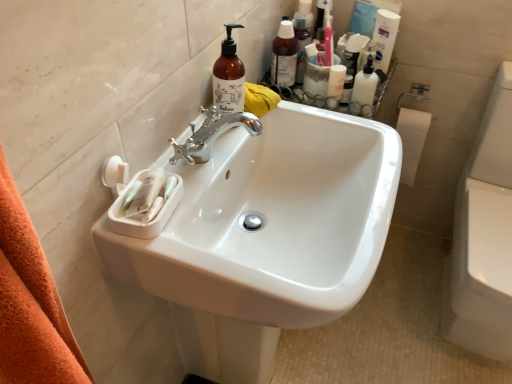
What is the approximate width of white glossy lotion at upper right, marked as the 3th toiletry in a left-to-right arrangement?

white glossy lotion at upper right, marked as the 3th toiletry in a left-to-right arrangement, is 1.95 inches wide.

What is the approximate height of white glossy lotion at upper right, acting as the first toiletry starting from the right?

white glossy lotion at upper right, acting as the first toiletry starting from the right, is 5.94 inches in height.

Describe the element at coordinates (384, 38) in the screenshot. I see `white glossy lotion at upper right, the first cleaning product viewed from the right` at that location.

Image resolution: width=512 pixels, height=384 pixels. What do you see at coordinates (271, 221) in the screenshot?
I see `white glossy sink at center` at bounding box center [271, 221].

The width and height of the screenshot is (512, 384). What do you see at coordinates (336, 81) in the screenshot?
I see `white matte jar at upper right, the second toiletry viewed from the left` at bounding box center [336, 81].

Find the location of a particular element. The width and height of the screenshot is (512, 384). translucent plastic bottles at upper right, which is the 1th toiletry in left-to-right order is located at coordinates (284, 56).

Where is `white glossy lotion at upper right, acting as the first toiletry starting from the right`? The image size is (512, 384). white glossy lotion at upper right, acting as the first toiletry starting from the right is located at coordinates (364, 89).

Which object is closer to the camera, white glossy toilet bowl at right or white matte jar at upper right, the 2th toiletry when ordered from right to left?

white glossy toilet bowl at right.

Who is bigger, white glossy toilet bowl at right or white matte jar at upper right, the 2th toiletry when ordered from right to left?

white glossy toilet bowl at right is bigger.

Looking at this image, from the image's perspective, which is below, white glossy toilet bowl at right or white matte jar at upper right, the second toiletry viewed from the left?

white glossy toilet bowl at right, from the image's perspective.

From a real-world perspective, is white glossy toilet bowl at right above or below white matte jar at upper right, the second toiletry viewed from the left?

white glossy toilet bowl at right is situated lower than white matte jar at upper right, the second toiletry viewed from the left, in the real world.

From the image's perspective, which is below, white glossy lotion at upper right, marked as the 3th toiletry in a left-to-right arrangement, or white glossy toilet bowl at right?

white glossy toilet bowl at right.

Between white glossy lotion at upper right, acting as the first toiletry starting from the right, and white glossy toilet bowl at right, which one has less height?

white glossy lotion at upper right, acting as the first toiletry starting from the right.

Is white glossy lotion at upper right, marked as the 3th toiletry in a left-to-right arrangement, thinner than white glossy toilet bowl at right?

Indeed, white glossy lotion at upper right, marked as the 3th toiletry in a left-to-right arrangement, has a lesser width compared to white glossy toilet bowl at right.

Which is in front, point (356, 100) or point (509, 269)?

The point (509, 269) is in front.

Can you confirm if white glossy sink at center is bigger than white glossy lotion at upper right, marked as the 3th toiletry in a left-to-right arrangement?

Indeed, white glossy sink at center has a larger size compared to white glossy lotion at upper right, marked as the 3th toiletry in a left-to-right arrangement.

What's the angular difference between white glossy sink at center and white glossy lotion at upper right, acting as the first toiletry starting from the right,'s facing directions?

91.2 degrees.

Can we say white glossy sink at center lies outside white glossy lotion at upper right, marked as the 3th toiletry in a left-to-right arrangement?

Yes, white glossy sink at center is outside of white glossy lotion at upper right, marked as the 3th toiletry in a left-to-right arrangement.

Looking at this image, which of these two, white glossy sink at center or white glossy lotion at upper right, acting as the first toiletry starting from the right, stands taller?

With more height is white glossy sink at center.

Is white glossy sink at center situated inside white matte jar at upper right, the second toiletry viewed from the left, or outside?

white glossy sink at center is located beyond the bounds of white matte jar at upper right, the second toiletry viewed from the left.

Is white glossy sink at center aimed at white matte jar at upper right, the second toiletry viewed from the left?

No, white glossy sink at center is not oriented towards white matte jar at upper right, the second toiletry viewed from the left.

You are a GUI agent. You are given a task and a screenshot of the screen. Output one action in this format:
    pyautogui.click(x=<x>, y=<y>)
    Task: Click on the sink lying in front of the white matte jar at upper right, the 2th toiletry when ordered from right to left
    This screenshot has width=512, height=384.
    Given the screenshot: What is the action you would take?
    pyautogui.click(x=271, y=221)

From the image's perspective, is white glossy sink at center over white matte jar at upper right, the 2th toiletry when ordered from right to left?

No, from the image's perspective, white glossy sink at center is not above white matte jar at upper right, the 2th toiletry when ordered from right to left.

From the image's perspective, which is above, white glossy toilet bowl at right or translucent plastic bottles at upper right, which is the 1th toiletry in left-to-right order?

translucent plastic bottles at upper right, which is the 1th toiletry in left-to-right order, is shown above in the image.

From a real-world perspective, between white glossy toilet bowl at right and translucent plastic bottles at upper right, the third toiletry viewed from the right, who is vertically higher?

translucent plastic bottles at upper right, the third toiletry viewed from the right.

Can you confirm if white glossy toilet bowl at right is wider than translucent plastic bottles at upper right, the third toiletry viewed from the right?

Yes.

Is the depth of white glossy toilet bowl at right less than that of translucent plastic bottles at upper right, the third toiletry viewed from the right?

Yes, the depth of white glossy toilet bowl at right is less than that of translucent plastic bottles at upper right, the third toiletry viewed from the right.

Can white glossy sink at center be found inside white glossy lotion at upper right, which ranks as the second cleaning product in left-to-right order?

No.

In terms of size, does white glossy lotion at upper right, which ranks as the 2th cleaning product in front-to-back order, appear bigger or smaller than white glossy sink at center?

In the image, white glossy lotion at upper right, which ranks as the 2th cleaning product in front-to-back order, appears to be smaller than white glossy sink at center.

From the image's perspective, relative to white glossy sink at center, is white glossy lotion at upper right, positioned as the 1th cleaning product in top-to-bottom order, above or below?

From the image's perspective, white glossy lotion at upper right, positioned as the 1th cleaning product in top-to-bottom order, appears above white glossy sink at center.

From a real-world perspective, is white glossy lotion at upper right, the second cleaning product ordered from the bottom, on white glossy sink at center?

Correct, in the physical world, white glossy lotion at upper right, the second cleaning product ordered from the bottom, is higher than white glossy sink at center.

From the image's perspective, which one is positioned lower, white glossy lotion at upper right, which ranks as the 2th cleaning product in front-to-back order, or translucent amber bottle at upper center, which is the first cleaning product from left to right?

translucent amber bottle at upper center, which is the first cleaning product from left to right, appears lower in the image.

Find the location of `cleaning product that appears on the left of white glossy lotion at upper right, which ranks as the 2th cleaning product in front-to-back order`. cleaning product that appears on the left of white glossy lotion at upper right, which ranks as the 2th cleaning product in front-to-back order is located at coordinates (229, 76).

How different are the orientations of white glossy lotion at upper right, positioned as the 1th cleaning product in top-to-bottom order, and translucent amber bottle at upper center, which ranks as the 1th cleaning product in bottom-to-top order, in degrees?

white glossy lotion at upper right, positioned as the 1th cleaning product in top-to-bottom order, and translucent amber bottle at upper center, which ranks as the 1th cleaning product in bottom-to-top order, are facing 128 degrees away from each other.

From a real-world perspective, relative to translucent amber bottle at upper center, which is the first cleaning product from left to right, is white glossy lotion at upper right, the second cleaning product ordered from the bottom, vertically above or below?

white glossy lotion at upper right, the second cleaning product ordered from the bottom, is situated lower than translucent amber bottle at upper center, which is the first cleaning product from left to right, in the real world.

Identify the location of toilet bowl located below the white matte jar at upper right, the 2th toiletry when ordered from right to left (from the image's perspective). The width and height of the screenshot is (512, 384). (484, 236).

In order to click on toilet bowl directly beneath the white glossy lotion at upper right, acting as the first toiletry starting from the right (from a real-world perspective) in this screenshot , I will do `click(484, 236)`.

Considering their positions, is white glossy lotion at upper right, which ranks as the 2th cleaning product in front-to-back order, positioned closer to translucent amber bottle at upper center, which ranks as the 1th cleaning product in bottom-to-top order, than white glossy toilet bowl at right?

white glossy lotion at upper right, which ranks as the 2th cleaning product in front-to-back order.

Based on their spatial positions, is white glossy lotion at upper right, marked as the 3th toiletry in a left-to-right arrangement, or white glossy lotion at upper right, which ranks as the 2th cleaning product in front-to-back order, closer to white glossy toilet bowl at right?

Among the two, white glossy lotion at upper right, marked as the 3th toiletry in a left-to-right arrangement, is located nearer to white glossy toilet bowl at right.

Looking at the image, which one is located further to white matte jar at upper right, the 2th toiletry when ordered from right to left, white glossy toilet bowl at right or translucent amber bottle at upper center, the 2th cleaning product positioned from the back?

white glossy toilet bowl at right is positioned further to the anchor white matte jar at upper right, the 2th toiletry when ordered from right to left.

From the picture: When comparing their distances from white glossy lotion at upper right, which ranks as the 2th cleaning product in front-to-back order, does white matte jar at upper right, the 2th toiletry when ordered from right to left, or translucent amber bottle at upper center, which ranks as the 1th cleaning product in front-to-back order, seem closer?

white matte jar at upper right, the 2th toiletry when ordered from right to left, is positioned closer to the anchor white glossy lotion at upper right, which ranks as the 2th cleaning product in front-to-back order.

Considering their positions, is white glossy sink at center positioned further to translucent amber bottle at upper center, which ranks as the 1th cleaning product in front-to-back order, than white glossy lotion at upper right, which ranks as the 2th cleaning product in front-to-back order?

white glossy lotion at upper right, which ranks as the 2th cleaning product in front-to-back order, is positioned further to the anchor translucent amber bottle at upper center, which ranks as the 1th cleaning product in front-to-back order.

When comparing their distances from white glossy toilet bowl at right, does white glossy lotion at upper right, acting as the first toiletry starting from the right, or white glossy sink at center seem closer?

Based on the image, white glossy lotion at upper right, acting as the first toiletry starting from the right, appears to be nearer to white glossy toilet bowl at right.

When comparing their distances from translucent amber bottle at upper center, which appears as the 2th cleaning product when viewed from the right, does white matte jar at upper right, the 2th toiletry when ordered from right to left, or white glossy sink at center seem closer?

Answer: Based on the image, white glossy sink at center appears to be nearer to translucent amber bottle at upper center, which appears as the 2th cleaning product when viewed from the right.

Looking at the image, which one is located closer to translucent plastic bottles at upper right, which is the 1th toiletry in left-to-right order, white matte jar at upper right, the second toiletry viewed from the left, or white glossy lotion at upper right, marked as the 3th toiletry in a left-to-right arrangement?

Among the two, white matte jar at upper right, the second toiletry viewed from the left, is located nearer to translucent plastic bottles at upper right, which is the 1th toiletry in left-to-right order.

Where is `cleaning product that lies between white matte jar at upper right, the 2th toiletry when ordered from right to left, and white glossy sink at center from top to bottom`? cleaning product that lies between white matte jar at upper right, the 2th toiletry when ordered from right to left, and white glossy sink at center from top to bottom is located at coordinates pos(229,76).

Locate an element on the screen. The height and width of the screenshot is (384, 512). cleaning product situated between white glossy sink at center and white glossy toilet bowl at right from left to right is located at coordinates (384, 38).

Where is `cleaning product located between translucent plastic bottles at upper right, the third toiletry viewed from the right, and white glossy toilet bowl at right in the left-right direction`? Image resolution: width=512 pixels, height=384 pixels. cleaning product located between translucent plastic bottles at upper right, the third toiletry viewed from the right, and white glossy toilet bowl at right in the left-right direction is located at coordinates (384, 38).

Identify the location of cleaning product between white glossy lotion at upper right, positioned as the 1th cleaning product in top-to-bottom order, and white glossy sink at center vertically. The width and height of the screenshot is (512, 384). (229, 76).